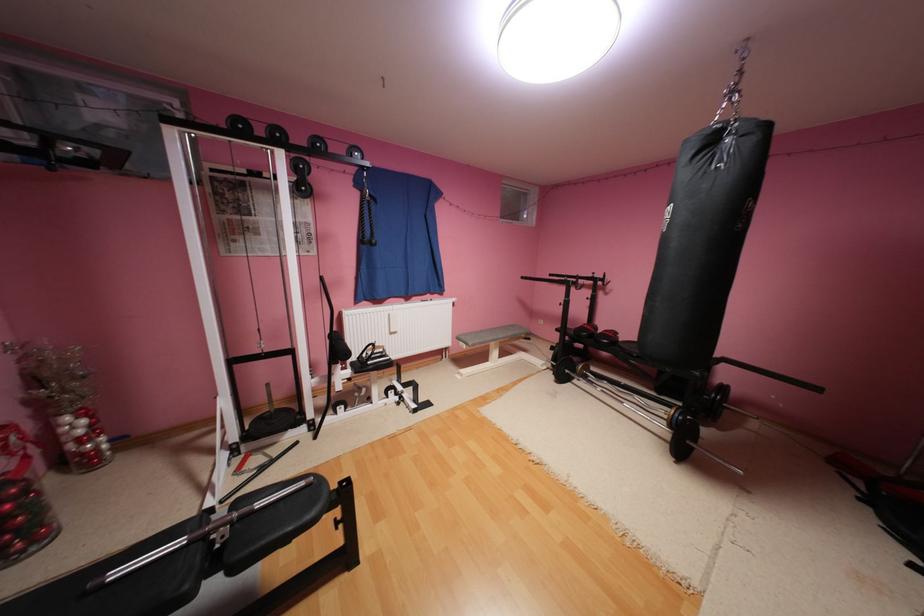
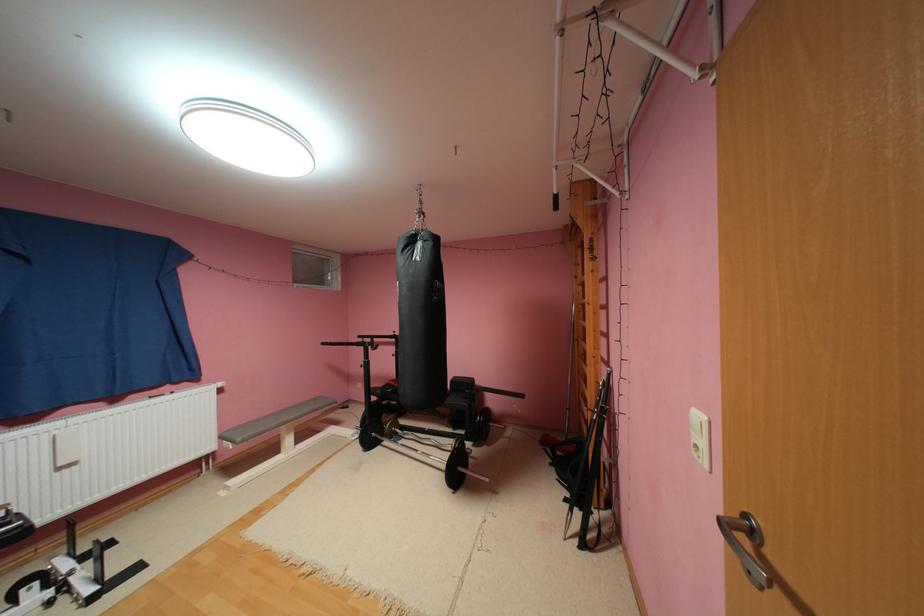
The point at (553, 367) is marked in the first image. Where is the corresponding point in the second image?

(366, 436)